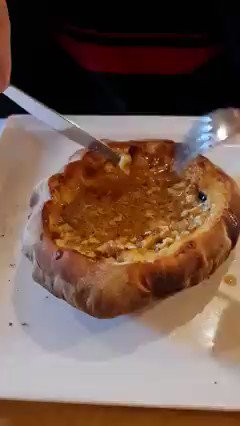
Where is `table`? The width and height of the screenshot is (240, 426). table is located at coordinates (120, 422).